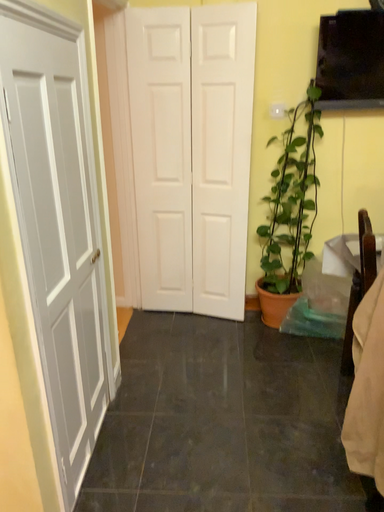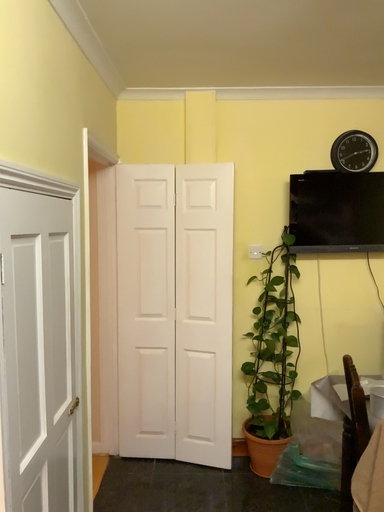
Question: How did the camera likely rotate when shooting the video?

Choices:
 (A) rotated upward
 (B) rotated downward

Answer: (A)